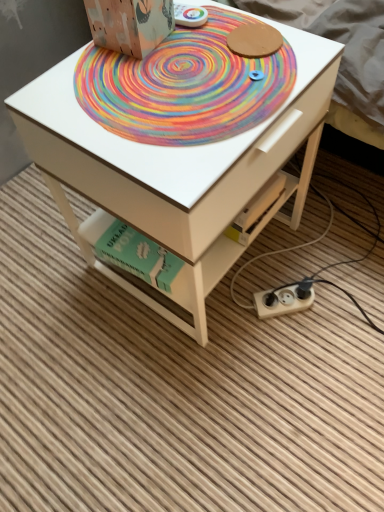
I want to click on vacant space situated above white matte table at center (from a real-world perspective), so click(188, 73).